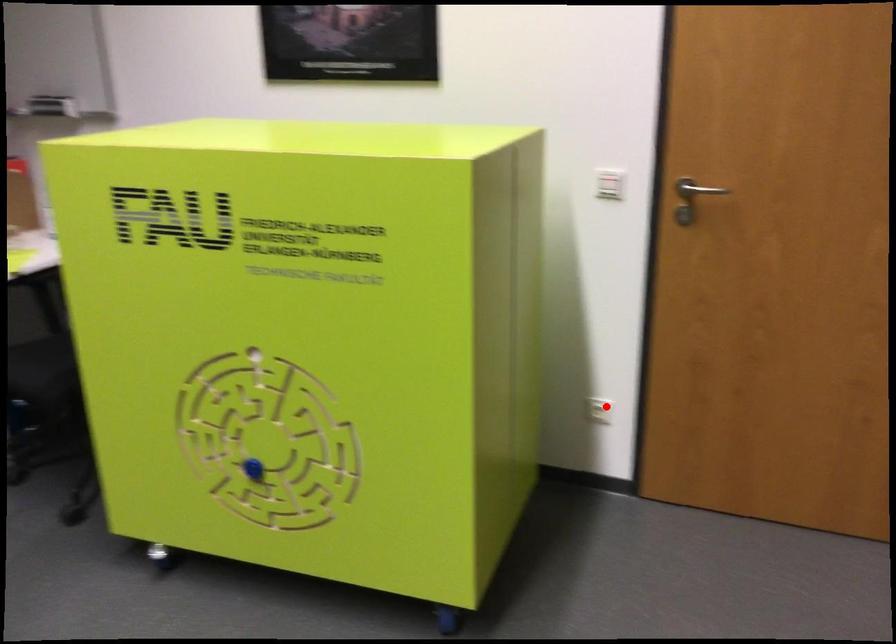
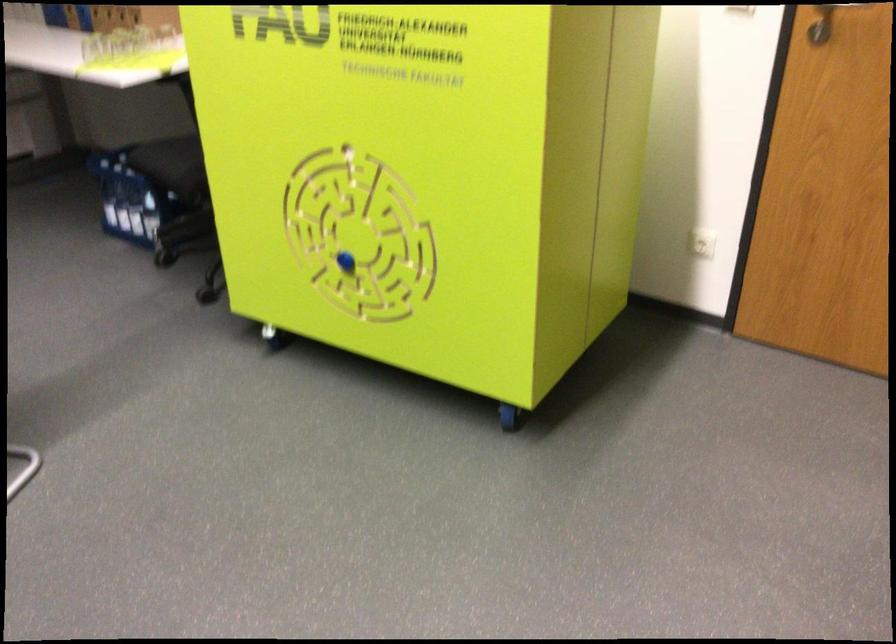
In the second image, find the point that corresponds to the highlighted location in the first image.

(702, 243)